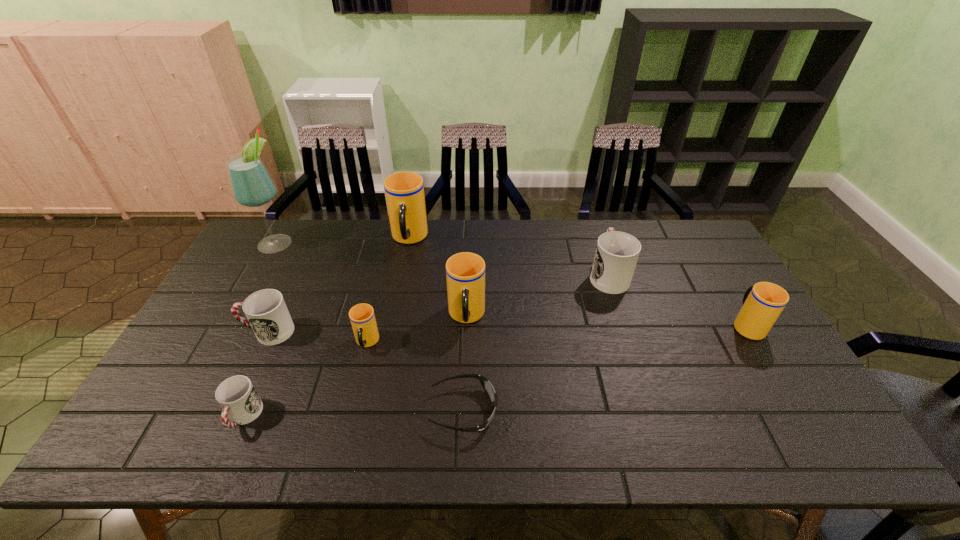
At what (x,y) coordinates should I click in order to perform the action: click on vacant area in the image that satisfies the following two spatial constraints: 1. on the side of the second farthest red cup where the handle is located; 2. on the side of the rightmost cup with the handle. Please return your answer as a coordinate pair (x, y). The image size is (960, 540). Looking at the image, I should click on (272, 325).